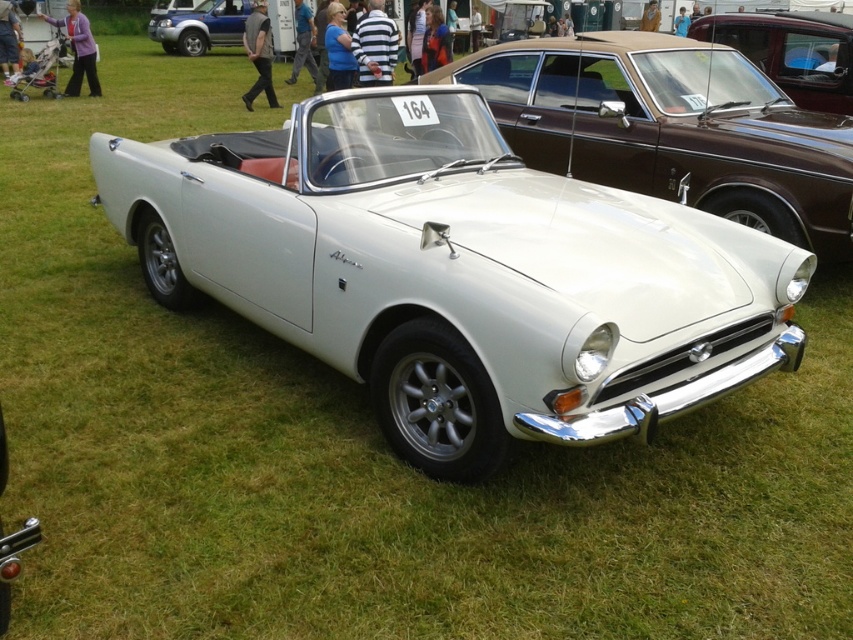
You are a photographer at the car show and want to take a photo of the white Sunbeam Alpine. You are standing at point (804, 33). If you move towards point (798, 216), will you be moving towards the front or the back of the car?

Moving from point (804, 33) to point (798, 216) means you are moving towards the front of the white Sunbeam Alpine because point (798, 216) is in front of point (804, 33).

You are a photographer at the car show and want to capture both the shiny brown car at upper right and the matte blue suv at upper left in a single frame. Considering their heights, which car should you position closer to the camera to ensure both are fully visible in the photo?

The shiny brown car at upper right is shorter than the matte blue suv at upper left. To ensure both are fully visible, position the shorter shiny brown car at upper right closer to the camera so its full height can be captured without the taller matte blue suv at upper left blocking it.